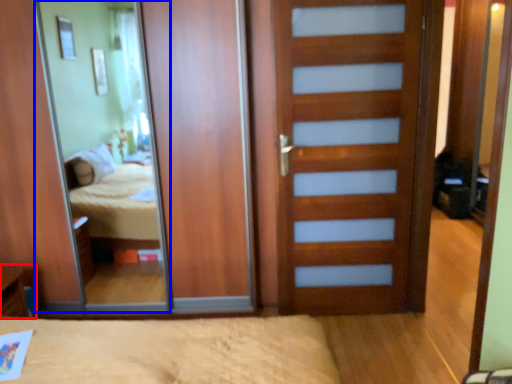
Question: Among these objects, which one is nearest to the camera, table (highlighted by a red box) or mirror (highlighted by a blue box)?

Choices:
 (A) table
 (B) mirror

Answer: (A)